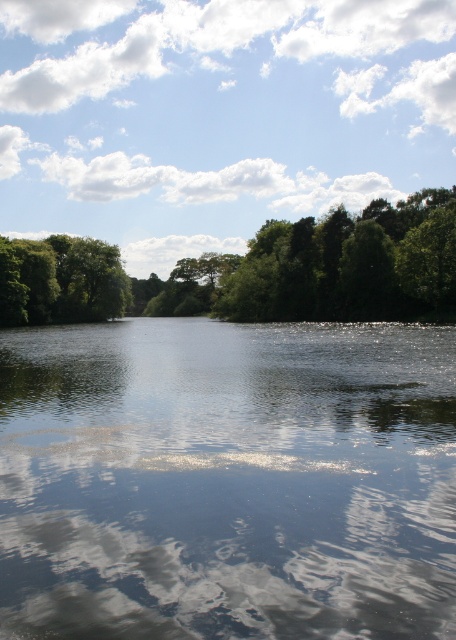
What do you see at coordinates (228, 481) in the screenshot? Image resolution: width=456 pixels, height=640 pixels. I see `transparent water at center` at bounding box center [228, 481].

Can you confirm if transparent water at center is wider than green leafy trees at upper center?

No.

You are a GUI agent. You are given a task and a screenshot of the screen. Output one action in this format:
    pyautogui.click(x=<x>, y=<y>)
    Task: Click on the transparent water at center
    
    Given the screenshot: What is the action you would take?
    pyautogui.click(x=228, y=481)

Between transparent water at center and green leafy trees at left, which one is positioned higher?

green leafy trees at left is higher up.

Is transparent water at center bigger than green leafy trees at left?

No, transparent water at center is not bigger than green leafy trees at left.

Is point (174, 547) more distant than point (93, 268)?

That is False.

I want to click on transparent water at center, so click(x=228, y=481).

Is white fluffy cloud at upper center further to camera compared to green leafy trees at upper center?

That is True.

Is point (341, 48) behind point (143, 304)?

Yes, it is behind point (143, 304).

I want to click on white fluffy cloud at upper center, so click(229, 51).